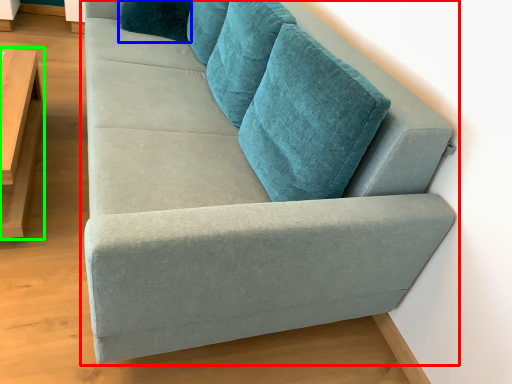
Question: Which is nearer to the studio couch (highlighted by a red box)? pillow (highlighted by a blue box) or table (highlighted by a green box).

Choices:
 (A) pillow
 (B) table

Answer: (B)